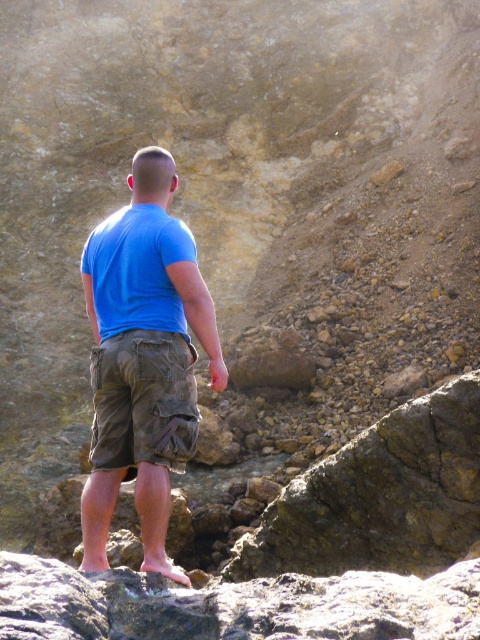
Question: Which object is closer to the camera taking this photo?

Choices:
 (A) olive green canvas shorts at center
 (B) blue cotton shirt at center

Answer: (B)

Question: Is blue cotton shirt at center bigger than olive green canvas shorts at center?

Choices:
 (A) no
 (B) yes

Answer: (B)

Question: From the image, what is the correct spatial relationship of blue cotton shirt at center in relation to olive green canvas shorts at center?

Choices:
 (A) right
 (B) left

Answer: (B)

Question: Can you confirm if blue cotton shirt at center is positioned below olive green canvas shorts at center?

Choices:
 (A) yes
 (B) no

Answer: (B)